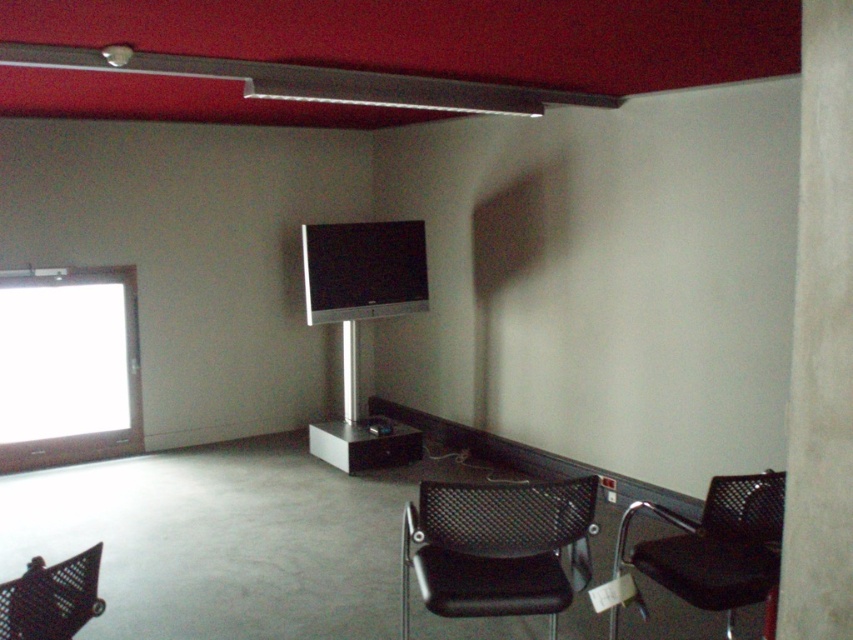
Question: Is satin black flat screen at center positioned in front of black mesh swivel chair at lower left?

Choices:
 (A) yes
 (B) no

Answer: (B)

Question: Which point appears closest to the camera in this image?

Choices:
 (A) (334, 248)
 (B) (3, 612)
 (C) (682, 593)
 (D) (573, 554)

Answer: (B)

Question: Can you confirm if black mesh chair at lower right is wider than satin black flat screen at center?

Choices:
 (A) no
 (B) yes

Answer: (A)

Question: Which object is closer to the camera taking this photo?

Choices:
 (A) black mesh swivel chair at lower left
 (B) satin black flat screen at center

Answer: (A)

Question: Can you confirm if black mesh chair at lower center is thinner than black mesh swivel chair at lower left?

Choices:
 (A) yes
 (B) no

Answer: (B)

Question: Which of the following is the closest to the observer?

Choices:
 (A) (36, 632)
 (B) (421, 509)
 (C) (344, 227)
 (D) (709, 566)

Answer: (A)